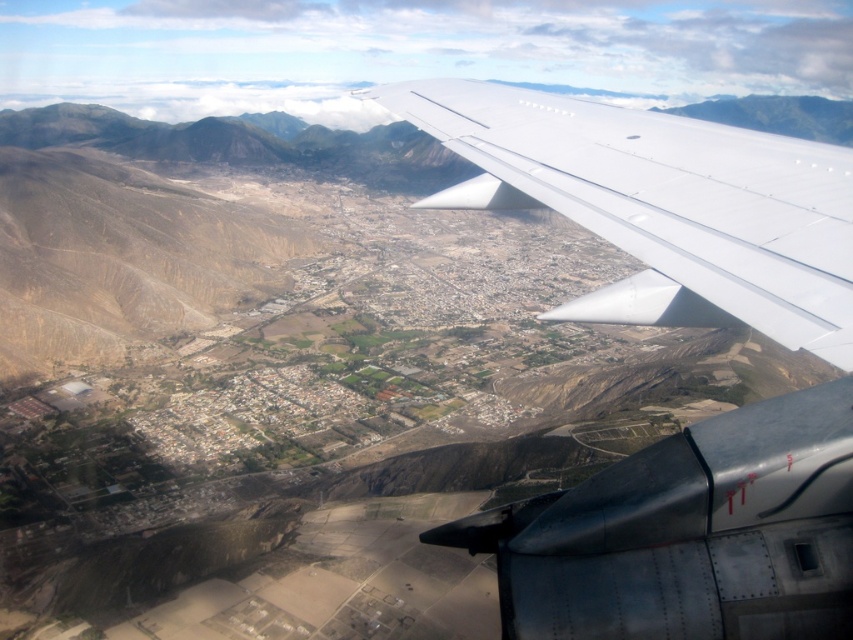
Question: Can you confirm if white metallic wing at upper center is bigger than transparent plastic airplane window at lower right?

Choices:
 (A) yes
 (B) no

Answer: (A)

Question: Does white metallic wing at upper center appear on the left side of transparent plastic airplane window at lower right?

Choices:
 (A) no
 (B) yes

Answer: (A)

Question: Which object is farther from the camera taking this photo?

Choices:
 (A) transparent plastic airplane window at lower right
 (B) white metallic wing at upper center

Answer: (B)

Question: From the image, what is the correct spatial relationship of white metallic wing at upper center in relation to transparent plastic airplane window at lower right?

Choices:
 (A) left
 (B) right

Answer: (B)

Question: Among these objects, which one is nearest to the camera?

Choices:
 (A) transparent plastic airplane window at lower right
 (B) white metallic wing at upper center

Answer: (A)